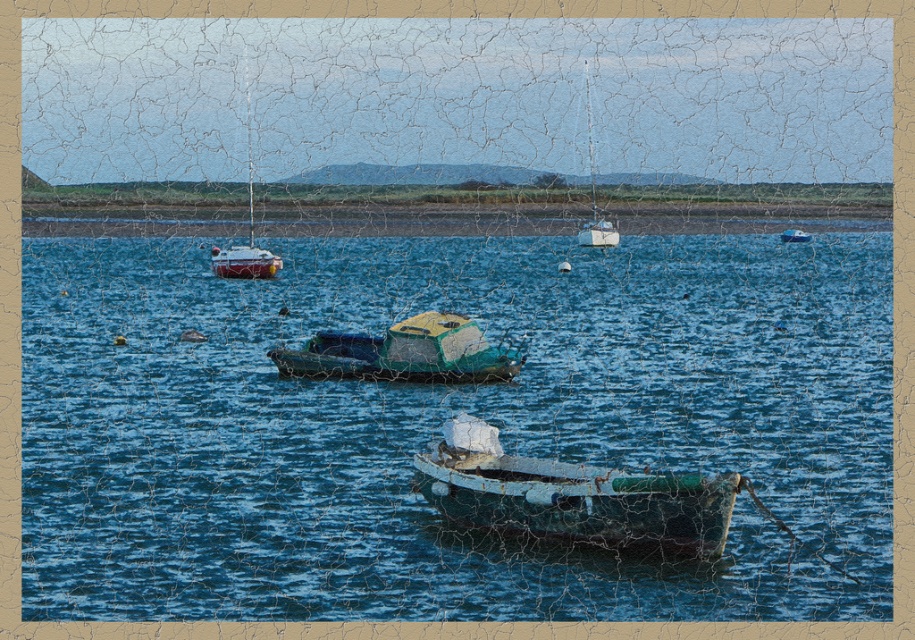
Who is positioned more to the right, rusty metal boat at center or white plastic boat at center?

white plastic boat at center is more to the right.

Based on the photo, does rusty metal boat at center have a lesser width compared to white plastic boat at center?

No.

The width and height of the screenshot is (915, 640). In order to click on rusty metal boat at center in this screenshot , I will do `click(571, 496)`.

Where is `rusty metal boat at center`? Image resolution: width=915 pixels, height=640 pixels. rusty metal boat at center is located at coordinates (571, 496).

Is blue water at center taller than white plastic boat at center?

Correct, blue water at center is much taller as white plastic boat at center.

Is blue water at center shorter than white plastic boat at center?

Incorrect, blue water at center's height does not fall short of white plastic boat at center's.

The height and width of the screenshot is (640, 915). I want to click on blue water at center, so click(445, 419).

Between rusty metal boat at center and green matte boat at center, which one appears on the right side from the viewer's perspective?

rusty metal boat at center is more to the right.

Identify the location of rusty metal boat at center. click(x=571, y=496).